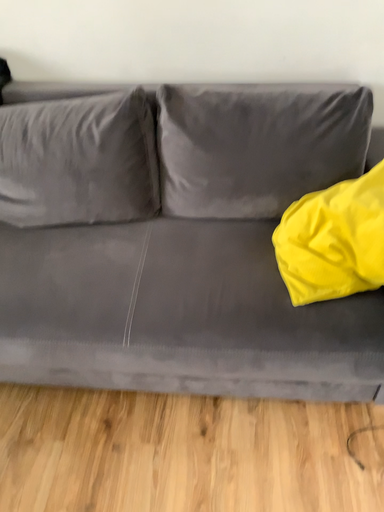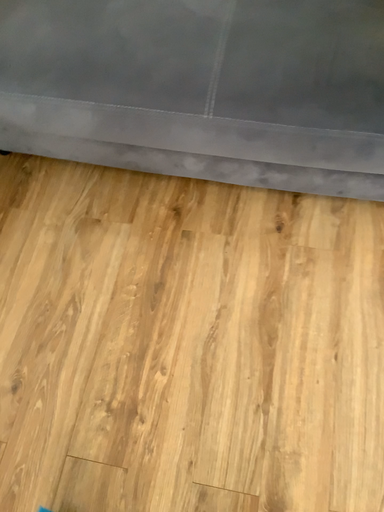
Question: How did the camera likely rotate when shooting the video?

Choices:
 (A) rotated right
 (B) rotated left

Answer: (B)